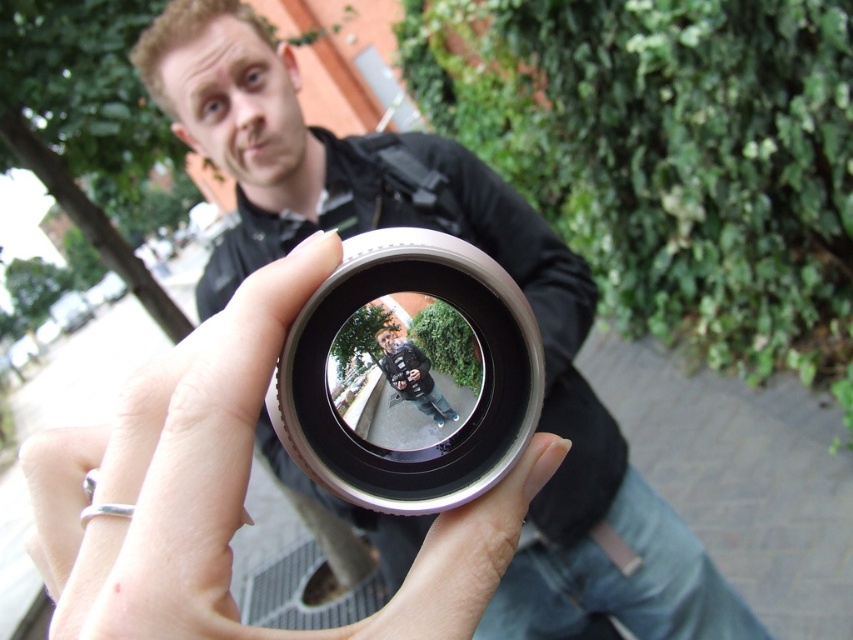
Consider the image. Can you confirm if silver metallic ring at center is positioned to the right of silver metallic lens at center?

In fact, silver metallic ring at center is to the left of silver metallic lens at center.

Does silver metallic ring at center have a lesser height compared to silver metallic lens at center?

Incorrect, silver metallic ring at center's height does not fall short of silver metallic lens at center's.

Who is more forward, (x=108, y=588) or (x=410, y=308)?

Positioned in front is point (x=108, y=588).

I want to click on silver metallic ring at center, so click(230, 492).